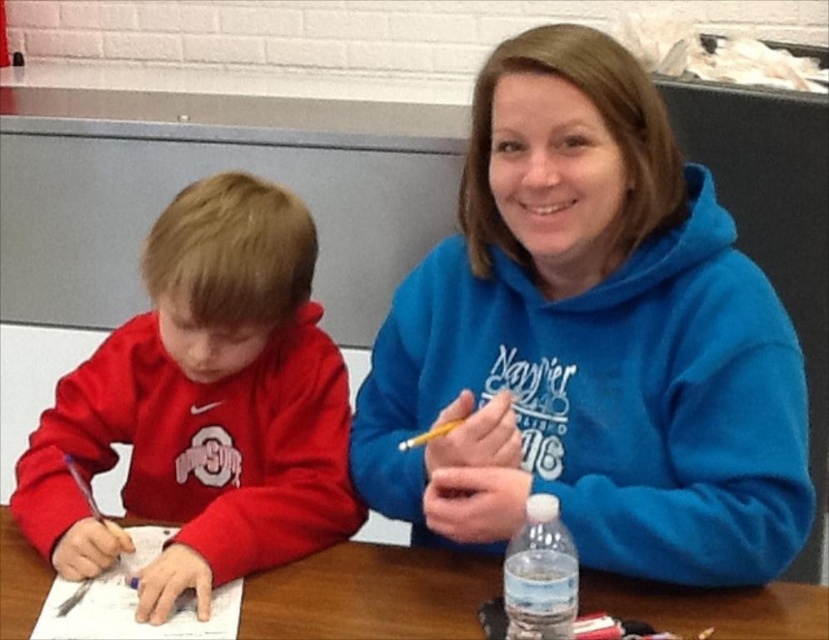
Does matte red sweatshirt at left appear under clear plastic bottle at lower center?

Actually, matte red sweatshirt at left is above clear plastic bottle at lower center.

Does point (240, 321) come behind point (515, 637)?

That is True.

This screenshot has width=829, height=640. In order to click on matte red sweatshirt at left in this screenshot , I will do `click(202, 406)`.

At what (x,y) coordinates should I click in order to perform the action: click on matte red sweatshirt at left. Please return your answer as a coordinate pair (x, y). The height and width of the screenshot is (640, 829). Looking at the image, I should click on (202, 406).

Can you confirm if blue fleece hoodie at upper right is shorter than clear plastic bottle at lower center?

No, blue fleece hoodie at upper right is not shorter than clear plastic bottle at lower center.

Does blue fleece hoodie at upper right appear under clear plastic bottle at lower center?

Actually, blue fleece hoodie at upper right is above clear plastic bottle at lower center.

Consider the image. Who is more distant from viewer, (718, 474) or (563, 525)?

The point (718, 474) is behind.

Where is `blue fleece hoodie at upper right`? The height and width of the screenshot is (640, 829). blue fleece hoodie at upper right is located at coordinates (589, 340).

Is matte red sweatshirt at left above wooden table at center?

Yes, matte red sweatshirt at left is above wooden table at center.

At what (x,y) coordinates should I click in order to perform the action: click on matte red sweatshirt at left. Please return your answer as a coordinate pair (x, y). The height and width of the screenshot is (640, 829). Looking at the image, I should click on (202, 406).

Where is `matte red sweatshirt at left`? The image size is (829, 640). matte red sweatshirt at left is located at coordinates (202, 406).